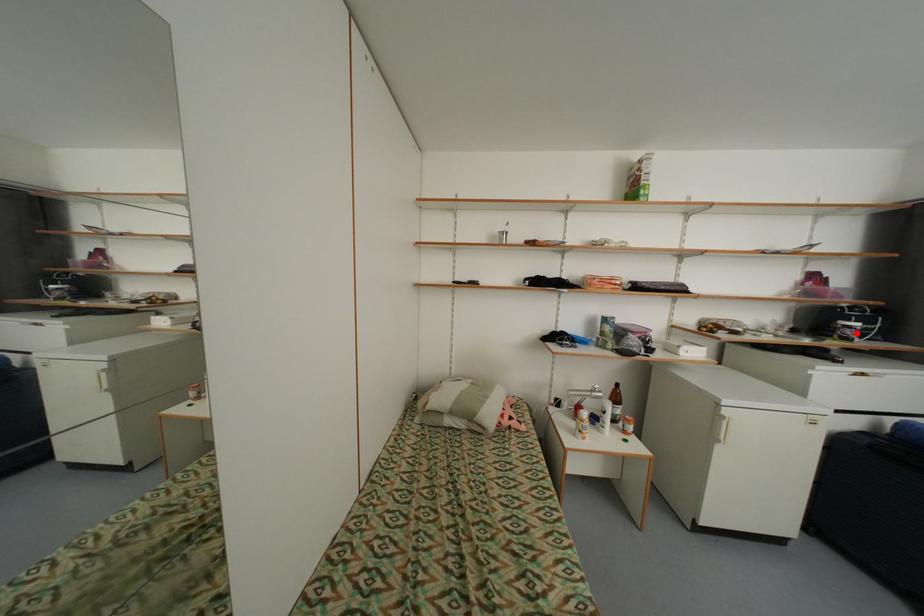
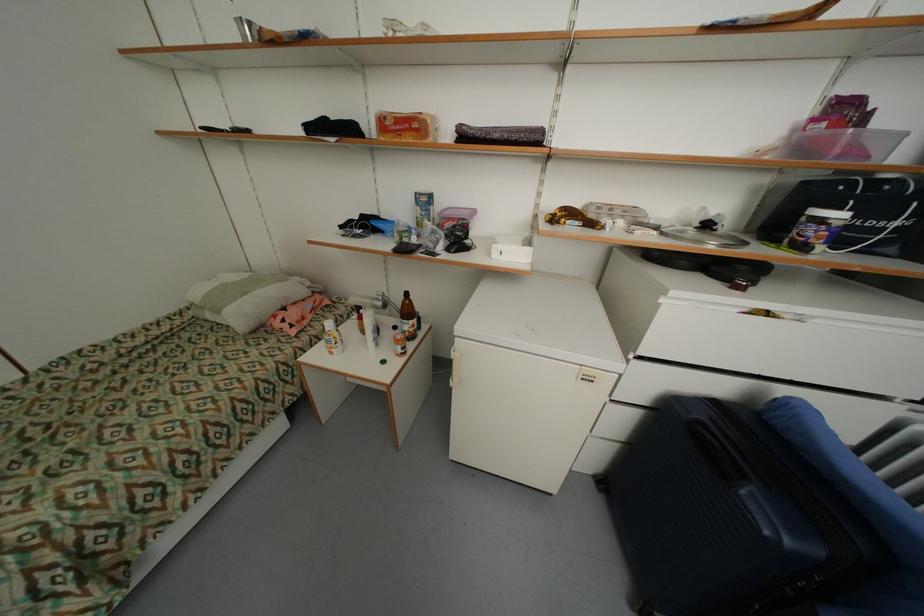
Locate, in the second image, the point that corresponds to the highlighted location in the first image.

(819, 233)